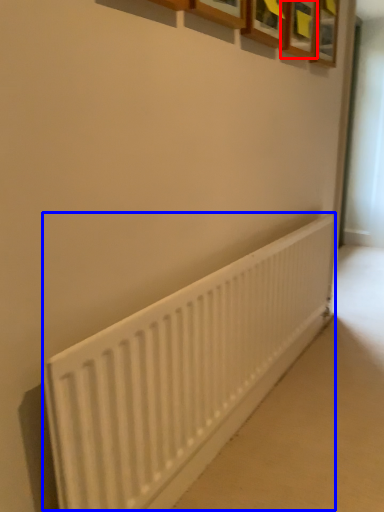
Question: Which point is closer to the camera, picture frame (highlighted by a red box) or radiator (highlighted by a blue box)?

Choices:
 (A) picture frame
 (B) radiator

Answer: (B)